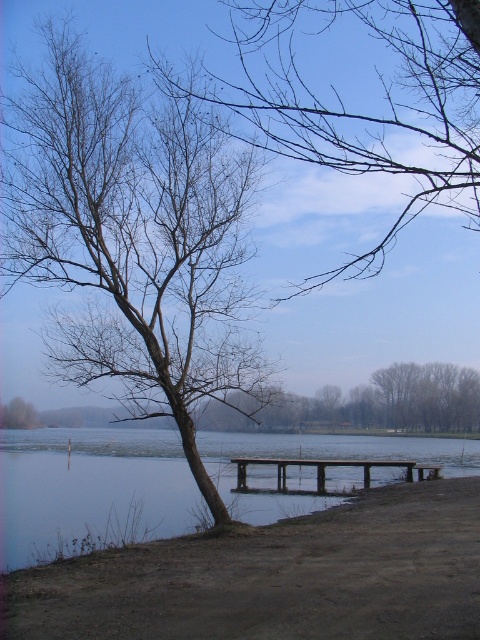
Question: Which of the following is the farthest from the observer?

Choices:
 (A) (240, 477)
 (B) (309, 88)
 (C) (434, 528)

Answer: (A)

Question: Is bare branches at left above brown wooden dock at center?

Choices:
 (A) no
 (B) yes

Answer: (B)

Question: Which object appears closest to the camera in this image?

Choices:
 (A) brown wooden dock at center
 (B) bare branches at left

Answer: (B)

Question: Considering the relative positions of bare branches at upper center and brown wooden dock at center in the image provided, where is bare branches at upper center located with respect to brown wooden dock at center?

Choices:
 (A) right
 (B) left

Answer: (B)

Question: Among these points, which one is farthest from the camera?

Choices:
 (A) (147, 250)
 (B) (178, 561)
 (C) (362, 148)
 (D) (420, 465)

Answer: (D)

Question: Considering the relative positions of transparent water at lower left and bare wood tree at left in the image provided, where is transparent water at lower left located with respect to bare wood tree at left?

Choices:
 (A) below
 (B) above

Answer: (A)